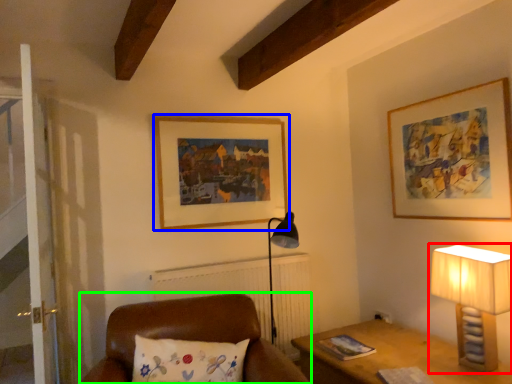
Question: Based on their relative distances, which object is nearer to lamp (highlighted by a red box)? Choose from picture frame (highlighted by a blue box) and furniture (highlighted by a green box).

Choices:
 (A) picture frame
 (B) furniture

Answer: (B)